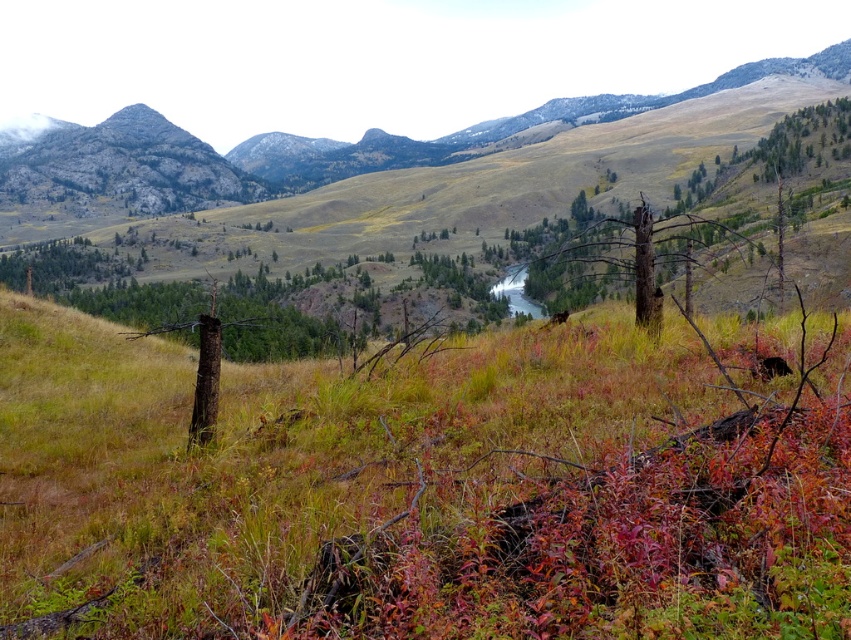
You are standing in the middle of the green grassy at center and looking towards the brown rough tree at center. Which object is closer to you?

The green grassy at center is closer to you because it is in front of the brown rough tree at center.

You are a landscape architect designing a walking path through the field. The path must pass between the green grassy at center and the brown rough tree at center. Given that the path requires a minimum width of 3 meters to accommodate visitors comfortably, can the space between them support this requirement?

The green grassy at center has a lesser width compared to brown rough tree at center. However, the question is about the space between them, not their individual widths. Since the provided information does not specify the distance between the two objects, it is impossible to determine if the path width requirement of 3 meters can be met. Additional measurements are needed.

You are standing at the point marked as point (426, 486) in the image. What type of terrain are you currently standing on?

The point (426, 486) is on green grassy at center, so you are standing on green grassy terrain.